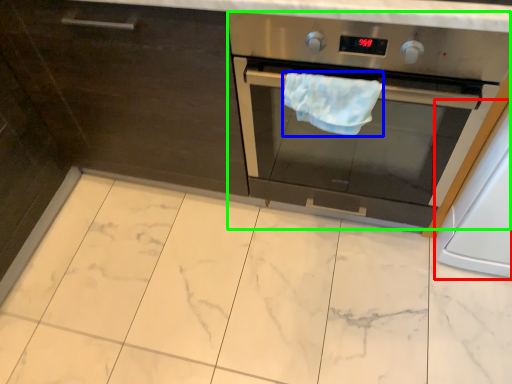
Question: Which is farther away from appliance (highlighted by a red box)? hand towel (highlighted by a blue box) or home appliance (highlighted by a green box)?

Choices:
 (A) hand towel
 (B) home appliance

Answer: (A)